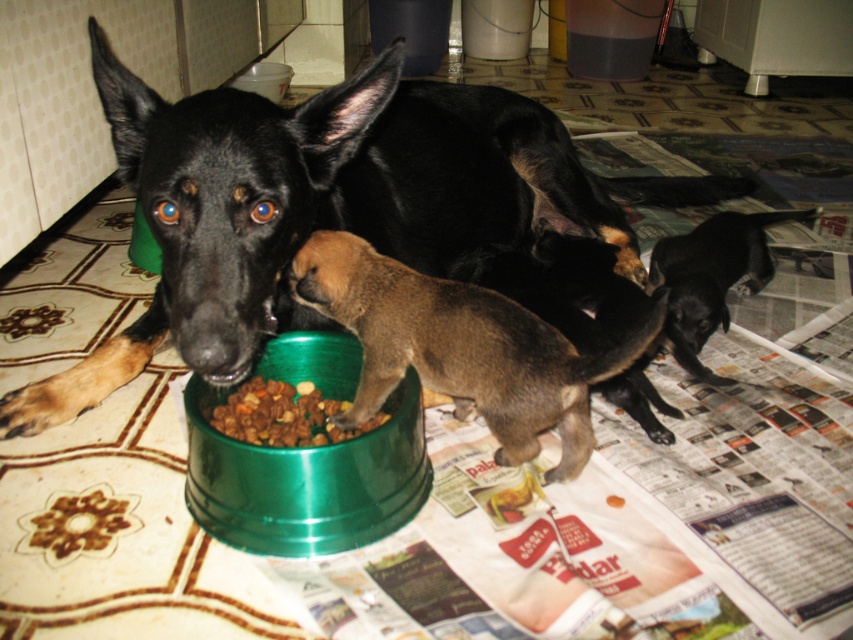
Question: Does black glossy dog at center appear over brown fur puppy at center?

Choices:
 (A) no
 (B) yes

Answer: (B)

Question: Which of the following is the closest to the observer?

Choices:
 (A) (711, 307)
 (B) (109, 125)
 (C) (311, 416)

Answer: (C)

Question: Which object is farther from the camera taking this photo?

Choices:
 (A) dry kibble at center
 (B) green metallic bowl at center
 (C) black glossy dog at center

Answer: (A)

Question: Which point is closer to the camera?

Choices:
 (A) black glossy dog at center
 (B) brown fur puppy at center

Answer: (B)

Question: Does green metallic bowl at center have a smaller size compared to black smooth coat at lower right?

Choices:
 (A) yes
 (B) no

Answer: (A)

Question: Can you confirm if brown fur puppy at center is smaller than dry kibble at center?

Choices:
 (A) no
 (B) yes

Answer: (A)